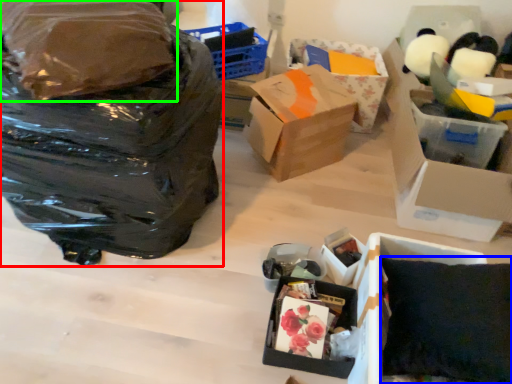
Question: Which object is the farthest from bag (highlighted by a red box)? Choose among these: pillow (highlighted by a blue box) or plastic bag (highlighted by a green box).

Choices:
 (A) pillow
 (B) plastic bag

Answer: (A)